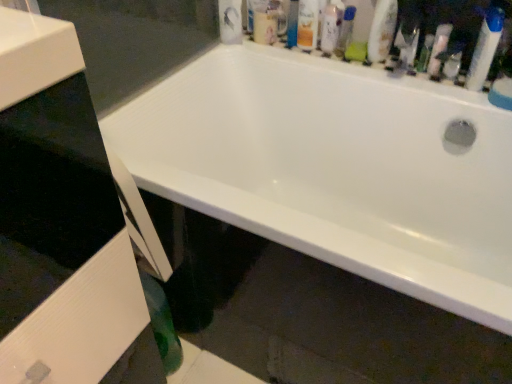
Question: From a real-world perspective, is green plastic mouthwash at upper center, which is counted as the third mouthwash, starting from the left, positioned under translucent plastic spray bottle at upper right, which appears as the 2th cleaning product when viewed from the left, based on gravity?

Choices:
 (A) no
 (B) yes

Answer: (A)

Question: Is green plastic mouthwash at upper center, which is counted as the third mouthwash, starting from the left, not near translucent plastic spray bottle at upper right, which is counted as the 1th cleaning product, starting from the right?

Choices:
 (A) yes
 (B) no

Answer: (B)

Question: Is green plastic mouthwash at upper center, the 1th mouthwash from the right, behind translucent plastic spray bottle at upper right, which is counted as the 1th cleaning product, starting from the right?

Choices:
 (A) yes
 (B) no

Answer: (A)

Question: Is green plastic mouthwash at upper center, the 1th mouthwash from the right, placed right next to translucent plastic spray bottle at upper right, which is counted as the 1th cleaning product, starting from the right?

Choices:
 (A) no
 (B) yes

Answer: (A)

Question: From the image's perspective, is green plastic mouthwash at upper center, the 1th mouthwash from the right, under translucent plastic spray bottle at upper right, which appears as the 2th cleaning product when viewed from the left?

Choices:
 (A) no
 (B) yes

Answer: (A)

Question: In terms of size, does white glossy bottle at upper right, the 1th cleaning product from the left, appear bigger or smaller than translucent plastic spray bottle at upper right, which appears as the 2th cleaning product when viewed from the left?

Choices:
 (A) big
 (B) small

Answer: (A)

Question: Is white glossy bottle at upper right, positioned as the second cleaning product in right-to-left order, taller or shorter than translucent plastic spray bottle at upper right, which appears as the 2th cleaning product when viewed from the left?

Choices:
 (A) tall
 (B) short

Answer: (A)

Question: From the image's perspective, relative to translucent plastic spray bottle at upper right, which is counted as the 1th cleaning product, starting from the right, is white glossy bottle at upper right, the 1th cleaning product from the left, above or below?

Choices:
 (A) above
 (B) below

Answer: (A)

Question: Considering their positions, is white glossy bottle at upper right, the 1th cleaning product from the left, located in front of or behind translucent plastic spray bottle at upper right, which is counted as the 1th cleaning product, starting from the right?

Choices:
 (A) behind
 (B) front

Answer: (A)

Question: Considering the positions of green plastic mouthwash at upper center, which is counted as the third mouthwash, starting from the left, and matte orange can at upper center, which ranks as the first toiletry in left-to-right order, in the image, is green plastic mouthwash at upper center, which is counted as the third mouthwash, starting from the left, taller or shorter than matte orange can at upper center, which ranks as the first toiletry in left-to-right order,?

Choices:
 (A) short
 (B) tall

Answer: (A)

Question: Is green plastic mouthwash at upper center, which is counted as the third mouthwash, starting from the left, situated inside matte orange can at upper center, which ranks as the first toiletry in left-to-right order, or outside?

Choices:
 (A) inside
 (B) outside

Answer: (B)

Question: Considering the positions of point (344, 34) and point (297, 26), is point (344, 34) closer or farther from the camera than point (297, 26)?

Choices:
 (A) farther
 (B) closer

Answer: (A)

Question: In terms of size, does green plastic mouthwash at upper center, the 1th mouthwash from the right, appear bigger or smaller than matte orange can at upper center, which ranks as the first toiletry in left-to-right order?

Choices:
 (A) small
 (B) big

Answer: (A)

Question: Does point pos(292,3) appear closer or farther from the camera than point pos(324,16)?

Choices:
 (A) closer
 (B) farther

Answer: (B)

Question: In terms of width, does translucent plastic mouthwash at upper center, the 2th mouthwash from the left, look wider or thinner when compared to white glossy lotion at upper center, which ranks as the third toiletry in right-to-left order?

Choices:
 (A) wide
 (B) thin

Answer: (A)